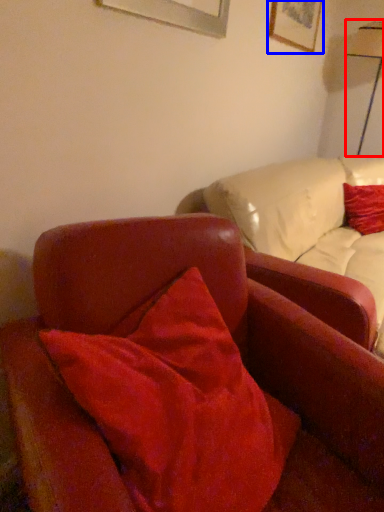
Question: Which object appears farthest to the camera in this image, table lamp (highlighted by a red box) or picture frame (highlighted by a blue box)?

Choices:
 (A) table lamp
 (B) picture frame

Answer: (A)